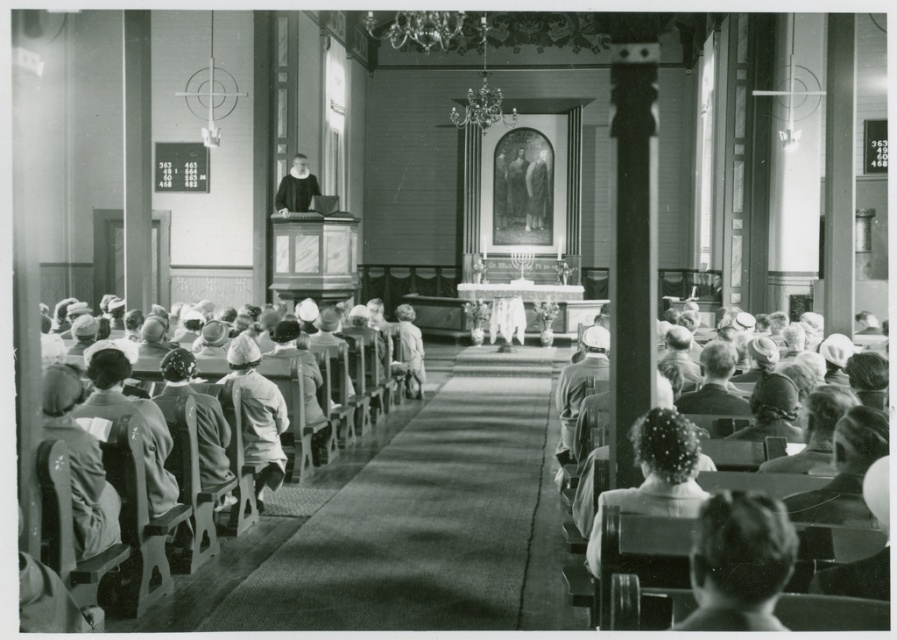
Does white fabric dress at left come behind smooth wooden statue at center?

No, white fabric dress at left is in front of smooth wooden statue at center.

From the picture: Can you confirm if white fabric dress at left is shorter than smooth wooden statue at center?

Indeed, white fabric dress at left has a lesser height compared to smooth wooden statue at center.

Who is more forward, (215,598) or (527,186)?

Point (215,598)

Image resolution: width=897 pixels, height=640 pixels. What are the coordinates of `white fabric dress at left` in the screenshot? It's located at point(260,536).

Who is more distant from viewer, (700,628) or (546,205)?

The point (546,205) is more distant.

In the scene shown: Is short hair at lower right smaller than smooth wooden statue at center?

Correct, short hair at lower right occupies less space than smooth wooden statue at center.

Is point (690, 620) positioned after point (547, 156)?

No, (690, 620) is in front of (547, 156).

Identify the location of short hair at lower right. point(739,563).

Does smooth wooden statue at center appear on the left side of smooth black robe at center?

In fact, smooth wooden statue at center is to the right of smooth black robe at center.

What do you see at coordinates (537, 192) in the screenshot?
I see `smooth wooden statue at center` at bounding box center [537, 192].

What do you see at coordinates (537, 192) in the screenshot? The height and width of the screenshot is (640, 897). I see `smooth wooden statue at center` at bounding box center [537, 192].

Identify the location of smooth wooden statue at center. (537, 192).